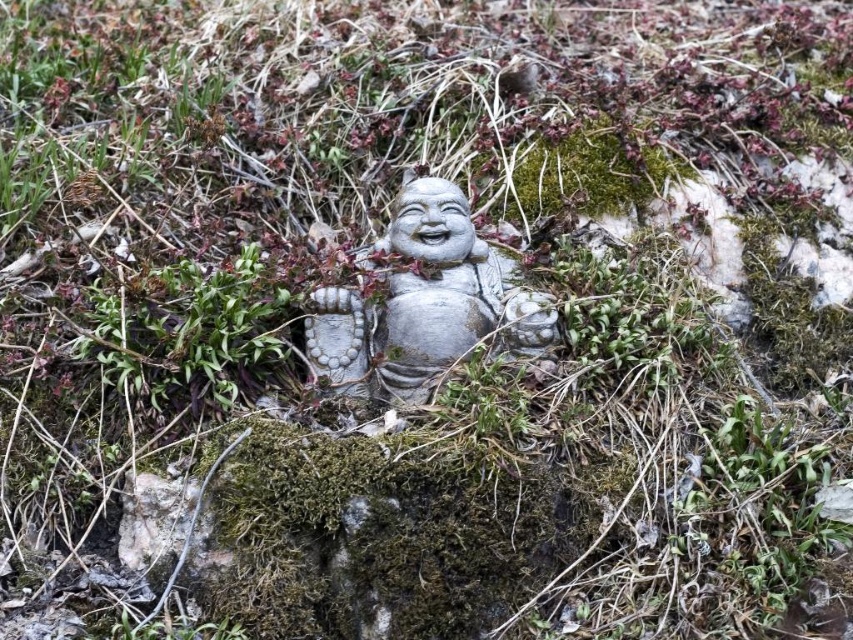
Question: In this image, where is satin silver statue at center located relative to green moss at center?

Choices:
 (A) right
 (B) left

Answer: (A)

Question: Does satin silver statue at center have a greater width compared to green moss at center?

Choices:
 (A) yes
 (B) no

Answer: (A)

Question: Among these points, which one is farthest from the camera?

Choices:
 (A) (241, 358)
 (B) (532, 323)

Answer: (B)

Question: Is satin silver statue at center smaller than green moss at center?

Choices:
 (A) no
 (B) yes

Answer: (A)